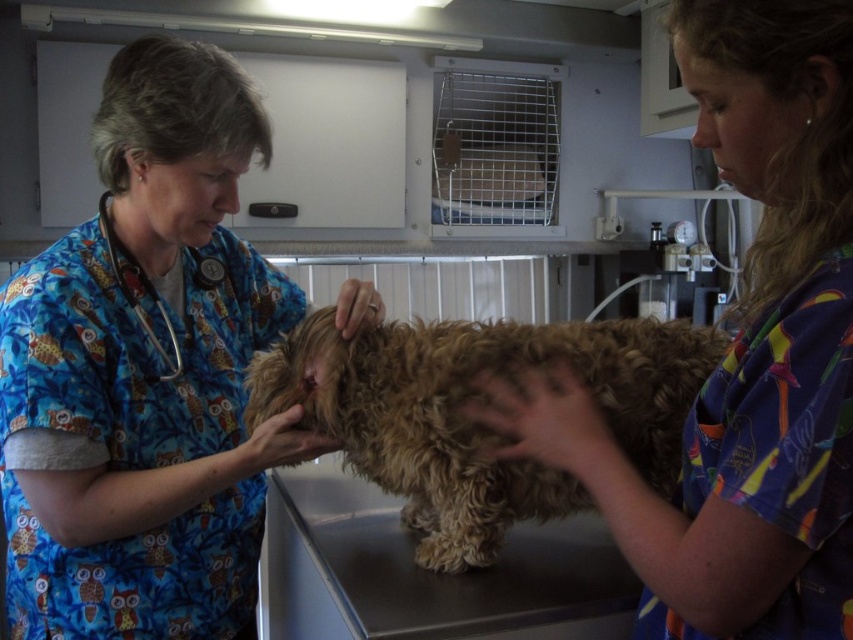
Question: Is blue printed scrubs at center wider than curly golden fur at center?

Choices:
 (A) no
 (B) yes

Answer: (A)

Question: Which object is positioned closest to the multicolored scrubs at center?

Choices:
 (A) blue printed scrubs at center
 (B) curly golden fur at center
 (C) blue fabric stethoscope at left

Answer: (B)

Question: Based on their relative distances, which object is farther from the multicolored scrubs at center?

Choices:
 (A) blue fabric stethoscope at left
 (B) curly golden fur at center
 (C) blue printed scrubs at center

Answer: (A)

Question: Which of these objects is positioned closest to the blue printed scrubs at center?

Choices:
 (A) blue fabric stethoscope at left
 (B) curly golden fur at center

Answer: (A)

Question: Is multicolored scrubs at center to the right of blue fabric stethoscope at left from the viewer's perspective?

Choices:
 (A) no
 (B) yes

Answer: (B)

Question: Does blue printed scrubs at center appear over curly golden fur at center?

Choices:
 (A) no
 (B) yes

Answer: (B)